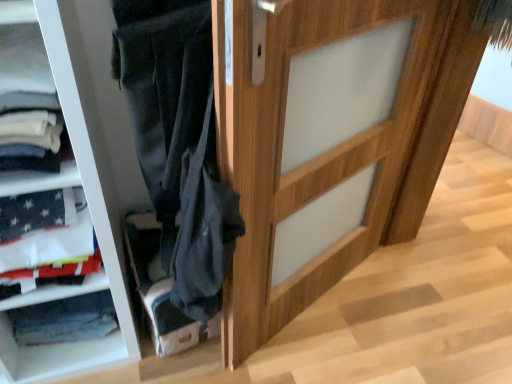
Locate an element on the screen. vacant area situated below velvet dark blue pants at lower center (from a real-world perspective) is located at coordinates (190, 347).